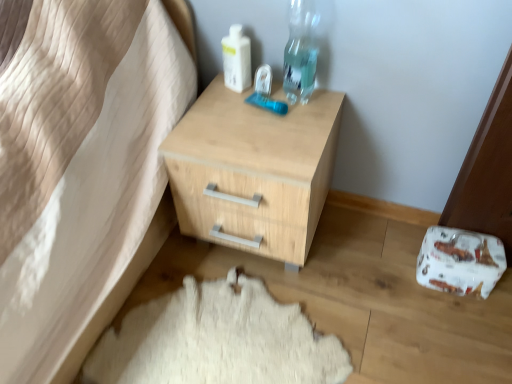
Question: Is transparent plastic bottle at upper right taller or shorter than white woolen rug at lower center?

Choices:
 (A) tall
 (B) short

Answer: (A)

Question: Based on their positions, is transparent plastic bottle at upper right located to the left or right of white woolen rug at lower center?

Choices:
 (A) left
 (B) right

Answer: (B)

Question: Which of these objects is positioned closest to the natural wood chest of drawers at center?

Choices:
 (A) white plastic bottle at upper center
 (B) white woolen rug at lower center
 (C) transparent plastic bottle at upper right

Answer: (C)

Question: Which object is positioned farthest from the natural wood chest of drawers at center?

Choices:
 (A) transparent plastic bottle at upper right
 (B) white woolen rug at lower center
 (C) white plastic bottle at upper center

Answer: (B)